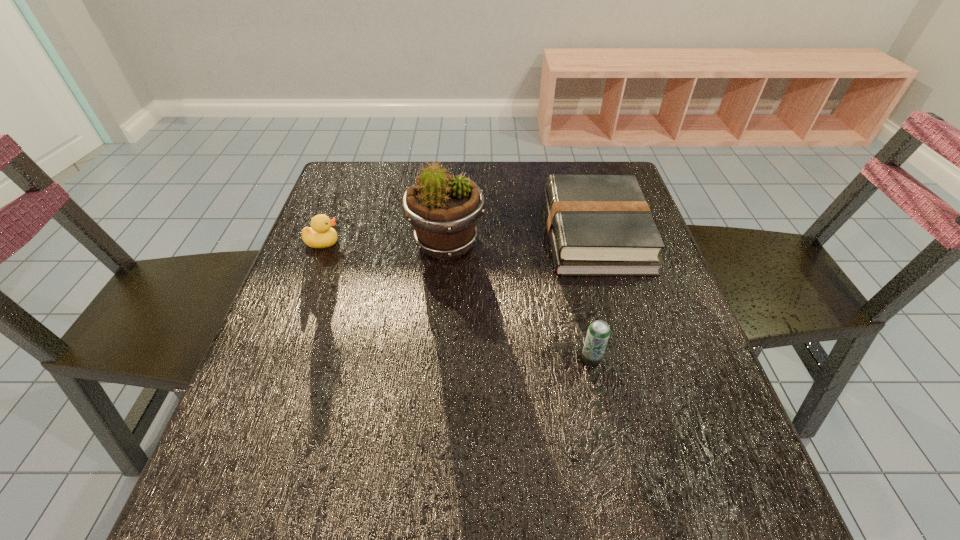
I want to click on free space at the far right corner, so click(x=601, y=165).

The height and width of the screenshot is (540, 960). In order to click on blank region between the duckling and the nearest object in this screenshot , I will do `click(457, 300)`.

The width and height of the screenshot is (960, 540). Find the location of `vacant region between the nearest object and the leftmost object`. vacant region between the nearest object and the leftmost object is located at coordinates (457, 300).

At what (x,y) coordinates should I click in order to perform the action: click on empty space between the beer can and the hardback book. Please return your answer as a coordinate pair (x, y). Looking at the image, I should click on (593, 296).

Where is `free space between the second object from left to right and the nearest object`? The image size is (960, 540). free space between the second object from left to right and the nearest object is located at coordinates (518, 300).

Find the location of a particular element. The width and height of the screenshot is (960, 540). vacant space that's between the beer can and the hardback book is located at coordinates (593, 296).

Locate an element on the screen. Image resolution: width=960 pixels, height=540 pixels. free area in between the hardback book and the beer can is located at coordinates (593, 296).

I want to click on empty location between the leftmost object and the nearest object, so click(x=457, y=300).

Image resolution: width=960 pixels, height=540 pixels. Find the location of `vacant region between the nearest object and the hardback book`. vacant region between the nearest object and the hardback book is located at coordinates (593, 296).

This screenshot has width=960, height=540. Identify the location of vacant area that lies between the tallest object and the hardback book. (520, 238).